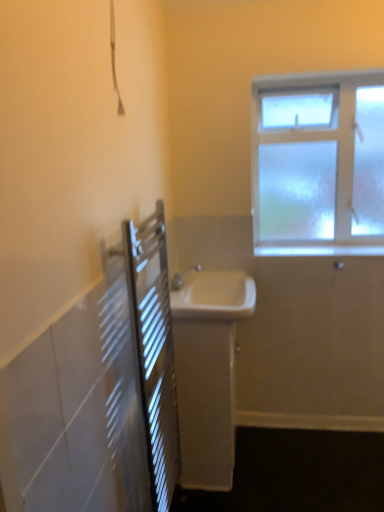
You are a GUI agent. You are given a task and a screenshot of the screen. Output one action in this format:
    pyautogui.click(x=<x>, y=<y>)
    Task: Click on the free spot above white glossy window sill at upper right (from a real-world perspective)
    The image size is (384, 512).
    Given the screenshot: What is the action you would take?
    pyautogui.click(x=327, y=250)